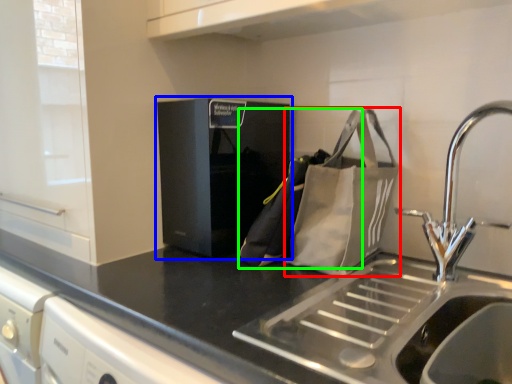
Question: Considering the real-world distances, which object is closest to pouch (highlighted by a red box)? home appliance (highlighted by a blue box) or messenger bag (highlighted by a green box).

Choices:
 (A) home appliance
 (B) messenger bag

Answer: (B)